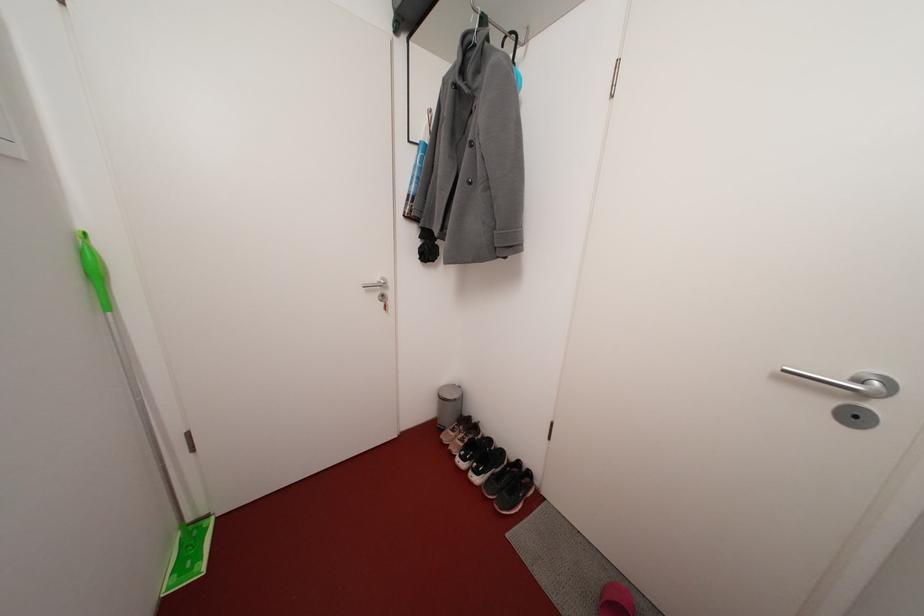
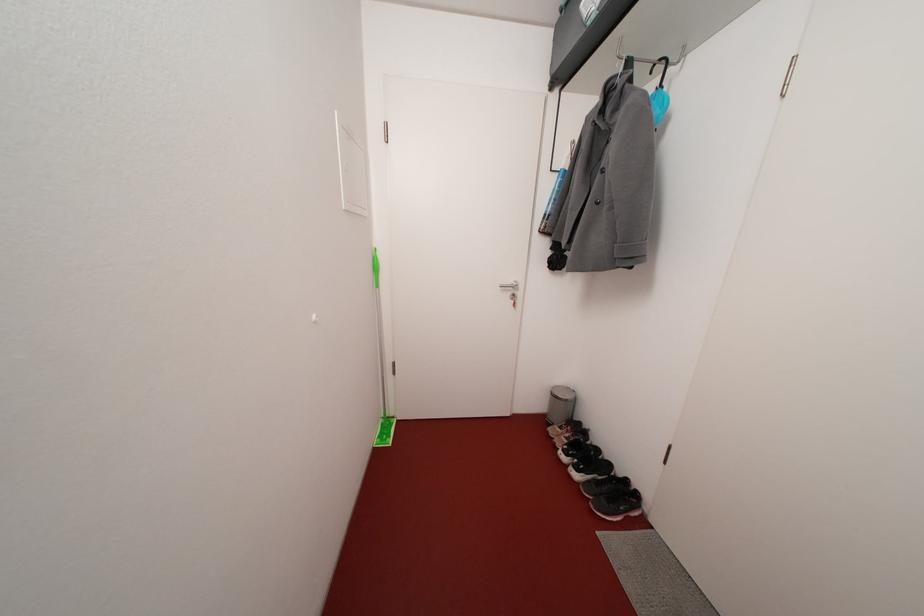
Where in the second image is the point corresponding to (448,405) from the first image?

(561, 402)